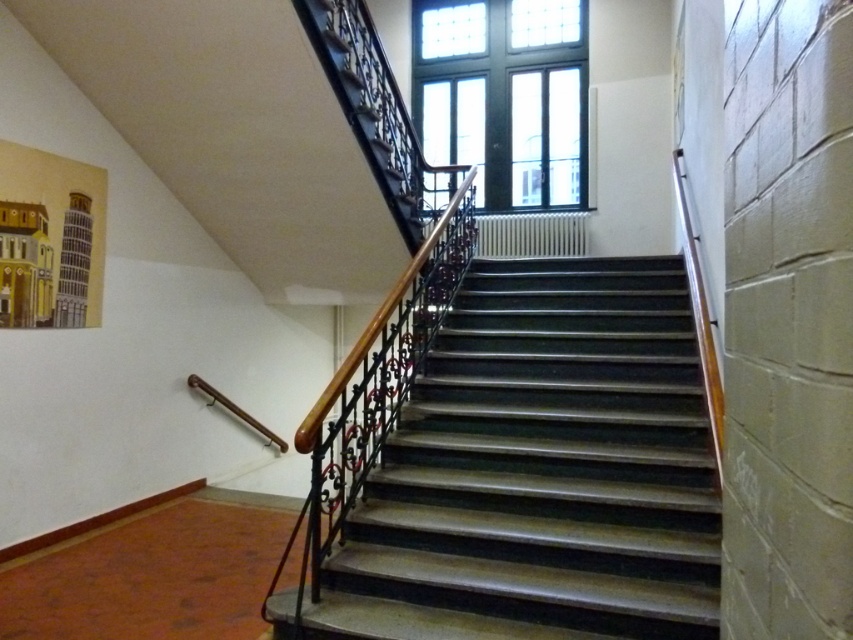
You are an interior designer planning to install a new chandelier in this staircase area. The chandelier must hang exactly between the shiny dark wood stairs at center and the clear glass window at upper center. Given that the chandelier requires 1.2 meters of clearance from both objects, will there be enough space to install it properly?

The shiny dark wood stairs at center has a lesser height compared to the clear glass window at upper center. Since the chandelier needs 1.2 meters of clearance from both, the total required space is 2.4 meters. However, the height difference between the two objects isn???t specified, so it???s unclear if there???s enough space. More information about their vertical distance is needed to determine feasibility.

Consider the image. You are standing at the bottom of the shiny dark wood stairs at center and want to reach the landing area. If your average step length is 2.5 feet, how many steps will you need to take to reach the landing area?

The shiny dark wood stairs at center is 7.95 feet from camera. Since each step is 2.5 feet, dividing 7.95 by 2.5 gives approximately 3.18 steps. Since you can only take whole steps, you will need to take 4 steps to reach the landing area.

You are standing at the base of the staircase and want to reach the landing area. The point marked at coordinates (541,468) is located on the stairs. Is this point part of the path you would take to reach the landing?

Yes, the point marked at coordinates (541,468) is on the shiny dark wood stairs at center, which is part of the path to the landing area.